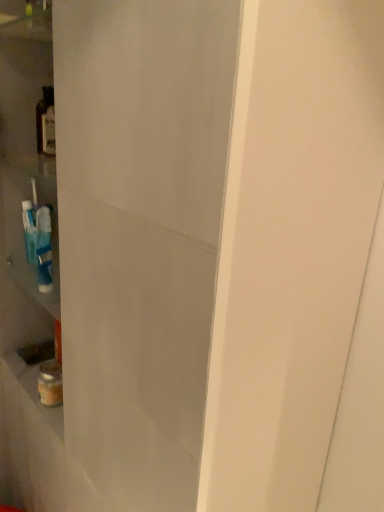
Question: From a real-world perspective, is transparent glass door at center physically located above or below translucent glass bottle at left?

Choices:
 (A) below
 (B) above

Answer: (A)

Question: Is transparent glass door at center bigger or smaller than translucent glass bottle at left?

Choices:
 (A) small
 (B) big

Answer: (B)

Question: From the image's perspective, relative to translucent glass bottle at left, is transparent glass door at center above or below?

Choices:
 (A) below
 (B) above

Answer: (A)

Question: In the image, is translucent glass bottle at left positioned in front of or behind transparent glass door at center?

Choices:
 (A) front
 (B) behind

Answer: (B)

Question: Would you say translucent glass bottle at left is inside or outside transparent glass door at center?

Choices:
 (A) outside
 (B) inside

Answer: (B)

Question: From the image's perspective, is translucent glass bottle at left located above or below transparent glass door at center?

Choices:
 (A) below
 (B) above

Answer: (B)

Question: From a real-world perspective, relative to transparent glass door at center, is translucent glass bottle at left vertically above or below?

Choices:
 (A) above
 (B) below

Answer: (A)